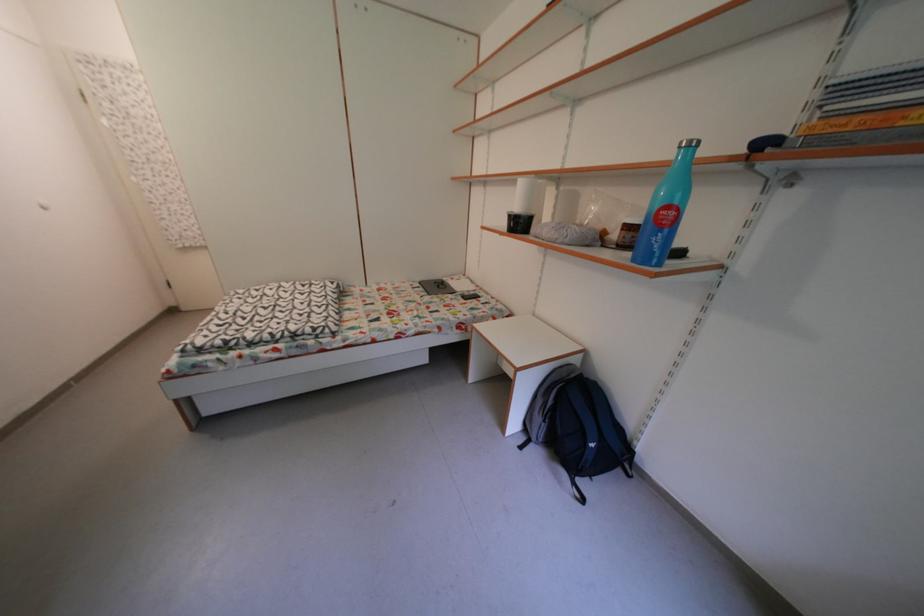
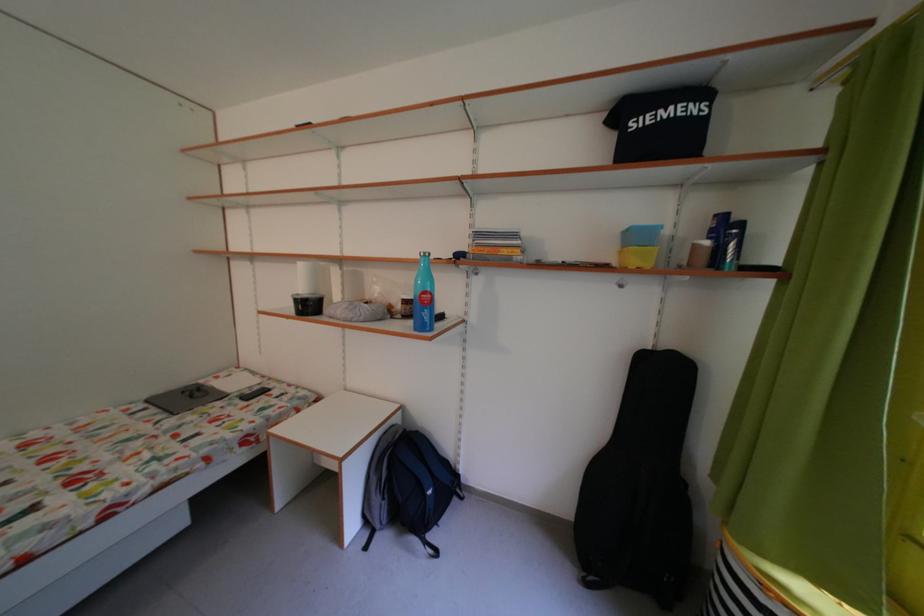
In the second image, find the point that corresponds to point (530, 187) in the first image.

(311, 270)